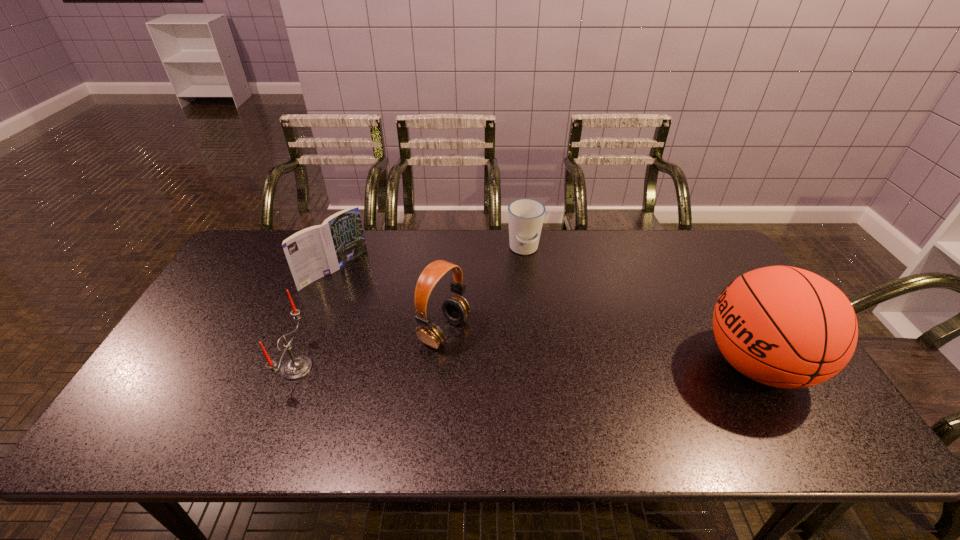
At what (x,y) coordinates should I click in order to perform the action: click on free location located 0.060m on the front cover of the book. Please return your answer as a coordinate pair (x, y). Looking at the image, I should click on (362, 293).

Locate an element on the screen. cup present at the far edge is located at coordinates (525, 216).

Locate an element on the screen. book at the far edge is located at coordinates (314, 252).

This screenshot has height=540, width=960. I want to click on candle that is at the near edge, so (296, 367).

Find the location of a particular element. The image size is (960, 540). basketball present at the near edge is located at coordinates (786, 327).

What are the coordinates of `object that is positioned at the right edge` in the screenshot? It's located at (786, 327).

Locate an element on the screen. The image size is (960, 540). object that is at the near right corner is located at coordinates (786, 327).

The width and height of the screenshot is (960, 540). What are the coordinates of `free point at the far edge` in the screenshot? It's located at (637, 230).

Image resolution: width=960 pixels, height=540 pixels. I want to click on free space at the near edge of the desktop, so (587, 382).

In the image, there is a desktop. Where is `free space at the left edge`? free space at the left edge is located at coordinates (161, 368).